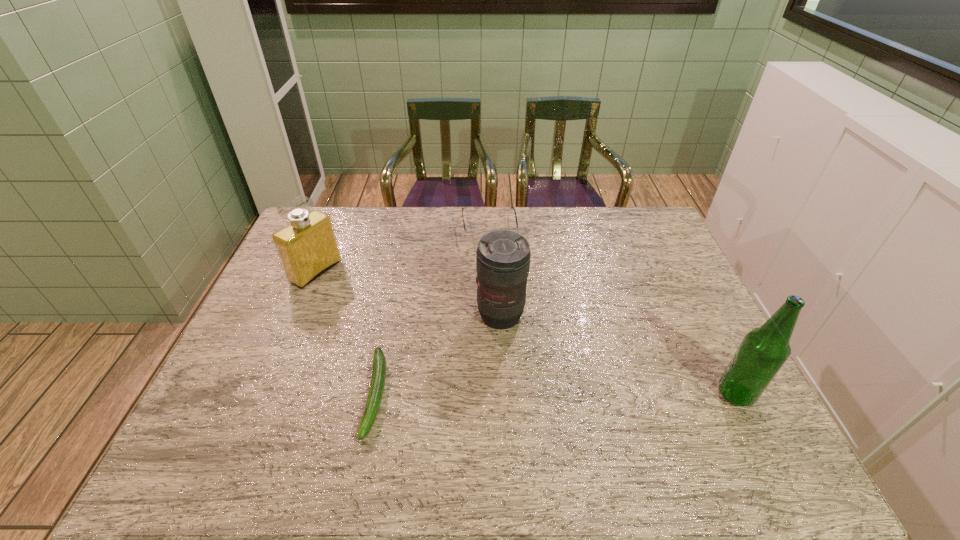
The height and width of the screenshot is (540, 960). I want to click on vacant position located 0.190m on the front-facing side of the fourth tallest object, so click(497, 283).

Where is `object located in the far edge section of the desktop`? Image resolution: width=960 pixels, height=540 pixels. object located in the far edge section of the desktop is located at coordinates (474, 236).

Find the location of `zucchini positioned at the near edge`. zucchini positioned at the near edge is located at coordinates (375, 394).

Identify the location of beer bottle present at the near edge. click(x=763, y=351).

Identify the location of object that is positioned at the left edge. (307, 247).

You are a GUI agent. You are given a task and a screenshot of the screen. Output one action in this format:
    pyautogui.click(x=<x>, y=<y>)
    Task: Click on the object that is at the right edge
    The image size is (960, 540).
    Given the screenshot: What is the action you would take?
    pyautogui.click(x=763, y=351)

At what (x,y) coordinates should I click in order to perform the action: click on object at the near right corner. Please return your answer as a coordinate pair (x, y). The width and height of the screenshot is (960, 540). Looking at the image, I should click on (763, 351).

This screenshot has height=540, width=960. What are the coordinates of `vacant position at the far edge of the desktop` in the screenshot? It's located at (502, 220).

I want to click on free region at the left edge of the desktop, so click(x=275, y=321).

Locate an element on the screen. The height and width of the screenshot is (540, 960). free space at the right edge of the desktop is located at coordinates (685, 326).